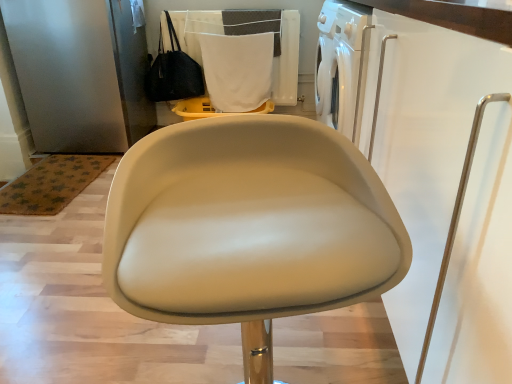
Find the location of a particular element. white fabric laundry at upper center is located at coordinates (287, 61).

This screenshot has width=512, height=384. Describe the element at coordinates (173, 72) in the screenshot. I see `black leather handbag at upper left` at that location.

Find the location of `white fabric laundry at upper center`. white fabric laundry at upper center is located at coordinates (287, 61).

Is white fabric laundry at upper center facing towards beige leather chair at center?

Yes, white fabric laundry at upper center faces towards beige leather chair at center.

Would you say white fabric laundry at upper center contains beige leather chair at center?

That's incorrect, beige leather chair at center is not inside white fabric laundry at upper center.

Can you confirm if white fabric laundry at upper center is taller than beige leather chair at center?

In fact, white fabric laundry at upper center may be shorter than beige leather chair at center.

From a real-world perspective, is white fabric laundry at upper center under beige leather chair at center?

No, from a real-world perspective, white fabric laundry at upper center is not below beige leather chair at center.

From the image's perspective, which is below, white fabric at upper center or beige leather chair at center?

beige leather chair at center.

Is white fabric at upper center facing away from beige leather chair at center?

That's not correct — white fabric at upper center is not looking away from beige leather chair at center.

From a real-world perspective, which object stands above the other?

white fabric at upper center is physically above.

Who is taller, white fabric at upper center or beige leather chair at center?

Standing taller between the two is beige leather chair at center.

Is white fabric at upper center smaller than black leather handbag at upper left?

Incorrect, white fabric at upper center is not smaller in size than black leather handbag at upper left.

Considering the sizes of objects white fabric at upper center and black leather handbag at upper left in the image provided, who is wider, white fabric at upper center or black leather handbag at upper left?

Wider between the two is black leather handbag at upper left.

From a real-world perspective, which object rests below the other?

white fabric at upper center is physically lower.

Does beige leather chair at center have a smaller size compared to white fabric laundry at upper center?

No.

In the scene shown: From a real-world perspective, is beige leather chair at center positioned under white fabric laundry at upper center based on gravity?

Yes, from a real-world perspective, beige leather chair at center is below white fabric laundry at upper center.

Identify the location of chair in front of the white fabric laundry at upper center. The height and width of the screenshot is (384, 512). (248, 227).

Is beige leather chair at center to the left of white fabric laundry at upper center from the viewer's perspective?

In fact, beige leather chair at center is to the right of white fabric laundry at upper center.

Is white fabric laundry at upper center inside or outside of black leather handbag at upper left?

white fabric laundry at upper center lies outside black leather handbag at upper left.

From the image's perspective, between white fabric laundry at upper center and black leather handbag at upper left, which one is located above?

white fabric laundry at upper center appears higher in the image.

Consider the image. Is white fabric laundry at upper center in front of black leather handbag at upper left?

Yes, white fabric laundry at upper center is closer to the camera.

Is white fabric at upper center next to white fabric laundry at upper center and touching it?

white fabric at upper center and white fabric laundry at upper center are clearly separated.

Can white fabric laundry at upper center be found inside white fabric at upper center?

Actually, white fabric laundry at upper center is outside white fabric at upper center.

From a real-world perspective, which is physically below, white fabric at upper center or white fabric laundry at upper center?

From a 3D spatial view, white fabric at upper center is below.

This screenshot has width=512, height=384. Find the location of `chair in front of the white fabric at upper center`. chair in front of the white fabric at upper center is located at coordinates (248, 227).

From the image's perspective, which one is positioned lower, beige leather chair at center or white fabric at upper center?

beige leather chair at center.

Does beige leather chair at center appear on the right side of white fabric at upper center?

Yes.

Is beige leather chair at center facing towards white fabric at upper center?

No, beige leather chair at center does not turn towards white fabric at upper center.

Identify the location of chair that is below the white fabric laundry at upper center (from the image's perspective). (248, 227).

Where is `cloth behind the beige leather chair at center`? This screenshot has width=512, height=384. cloth behind the beige leather chair at center is located at coordinates (237, 70).

Estimate the real-world distances between objects in this image. Which object is closer to beige leather chair at center, white fabric laundry at upper center or black leather handbag at upper left?

Among the two, black leather handbag at upper left is located nearer to beige leather chair at center.

When comparing their distances from white fabric laundry at upper center, does white fabric at upper center or beige leather chair at center seem closer?

Among the two, white fabric at upper center is located nearer to white fabric laundry at upper center.

When comparing their distances from white fabric laundry at upper center, does black leather handbag at upper left or white fabric at upper center seem closer?

Based on the image, white fabric at upper center appears to be nearer to white fabric laundry at upper center.

From the image, which object appears to be farther from beige leather chair at center, white fabric laundry at upper center or white fabric at upper center?

The object further to beige leather chair at center is white fabric laundry at upper center.

Estimate the real-world distances between objects in this image. Which object is further from black leather handbag at upper left, white fabric laundry at upper center or white fabric at upper center?

white fabric laundry at upper center is positioned further to the anchor black leather handbag at upper left.

Based on their spatial positions, is black leather handbag at upper left or beige leather chair at center closer to white fabric at upper center?

black leather handbag at upper left.

Which object lies nearer to the anchor point beige leather chair at center, white fabric at upper center or white fabric laundry at upper center?

white fabric at upper center is positioned closer to the anchor beige leather chair at center.

From the picture: Considering their positions, is black leather handbag at upper left positioned further to beige leather chair at center than white fabric at upper center?

Among the two, black leather handbag at upper left is located further to beige leather chair at center.

Where is `handbag between beige leather chair at center and white fabric at upper center from front to back`? The image size is (512, 384). handbag between beige leather chair at center and white fabric at upper center from front to back is located at coordinates (173, 72).

Identify the location of laundry between beige leather chair at center and white fabric at upper center along the z-axis. (287, 61).

Where is `laundry located between beige leather chair at center and black leather handbag at upper left in the depth direction`? laundry located between beige leather chair at center and black leather handbag at upper left in the depth direction is located at coordinates (287, 61).

Find the location of a particular element. The height and width of the screenshot is (384, 512). laundry situated between black leather handbag at upper left and white fabric at upper center from left to right is located at coordinates (287, 61).